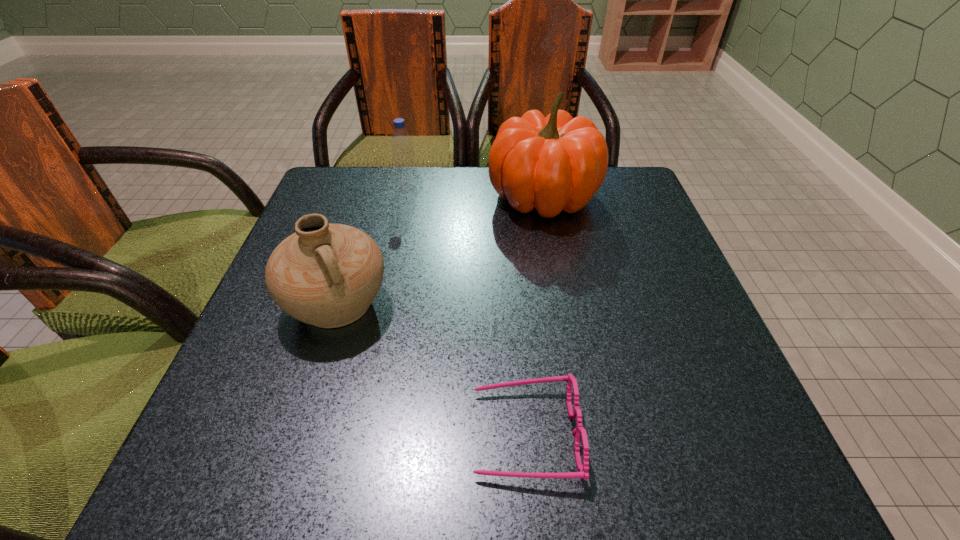
This screenshot has width=960, height=540. In order to click on free space located 0.240m on the arms of the spectacles in this screenshot , I will do `click(307, 434)`.

Locate an element on the screen. The height and width of the screenshot is (540, 960). pumpkin situated at the far edge is located at coordinates (553, 163).

Find the location of a particular element. bottle located at the far edge is located at coordinates (405, 172).

Locate an element on the screen. The height and width of the screenshot is (540, 960). object located in the near edge section of the desktop is located at coordinates (583, 469).

You are a GUI agent. You are given a task and a screenshot of the screen. Output one action in this format:
    pyautogui.click(x=<x>, y=<y>)
    Task: Click on the object located in the left edge section of the desktop
    
    Given the screenshot: What is the action you would take?
    pyautogui.click(x=327, y=275)

This screenshot has width=960, height=540. What are the coordinates of `object that is at the right edge` in the screenshot? It's located at coord(553,163).

The image size is (960, 540). Identify the location of object at the far right corner. (553, 163).

Locate an element on the screen. Image resolution: width=960 pixels, height=540 pixels. blank space at the far edge of the desktop is located at coordinates (497, 211).

Where is `vacant space at the left edge of the desktop`? The height and width of the screenshot is (540, 960). vacant space at the left edge of the desktop is located at coordinates pyautogui.click(x=336, y=347).

Find the location of a particular element. The image size is (960, 540). vacant area at the right edge is located at coordinates (608, 249).